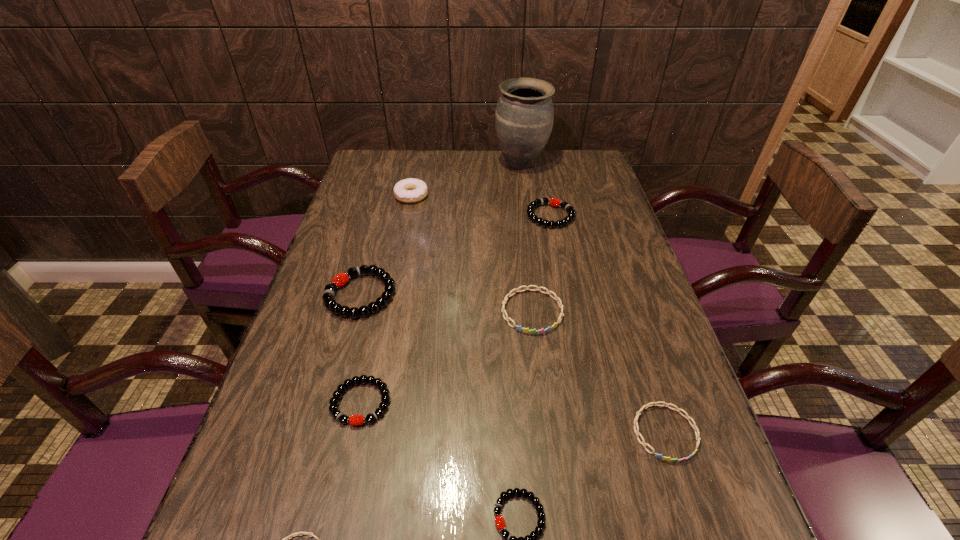
I want to click on vacant region between the third biggest black bracelet and the urn, so click(441, 283).

Where is `vacant space that is in between the third nearest black bracelet and the rightmost black bracelet`? vacant space that is in between the third nearest black bracelet and the rightmost black bracelet is located at coordinates (456, 255).

Select which object is the seventh closest to the nearest blue bracelet. Please provide its 2D coordinates. Your answer should be formatted as a tuple, i.e. [(x, y)], where the tuple contains the x and y coordinates of a point satisfying the conditions above.

[(411, 190)]

Locate which object ranks fourth in proximity to the doughnut. Please provide its 2D coordinates. Your answer should be formatted as a tuple, i.e. [(x, y)], where the tuple contains the x and y coordinates of a point satisfying the conditions above.

[(534, 331)]

Select which bracelet is the third closest to the third tallest object. Please provide its 2D coordinates. Your answer should be formatted as a tuple, i.e. [(x, y)], where the tuple contains the x and y coordinates of a point satisfying the conditions above.

[(554, 202)]

In order to click on bracelet that is the third closest one to the second blue bracelet from left to right in this screenshot , I will do `click(382, 386)`.

Image resolution: width=960 pixels, height=540 pixels. I want to click on black bracelet that is the third closest to the biggest black bracelet, so click(x=531, y=539).

Where is `black bracelet that is the nearest to the biggest black bracelet`? The height and width of the screenshot is (540, 960). black bracelet that is the nearest to the biggest black bracelet is located at coordinates (382, 386).

Identify which blue bracelet is located as the second nearest to the third nearest black bracelet. Please provide its 2D coordinates. Your answer should be formatted as a tuple, i.e. [(x, y)], where the tuple contains the x and y coordinates of a point satisfying the conditions above.

[(298, 533)]

Locate which blue bracelet is the closest to the shortest object. Please provide its 2D coordinates. Your answer should be formatted as a tuple, i.e. [(x, y)], where the tuple contains the x and y coordinates of a point satisfying the conditions above.

[(534, 331)]